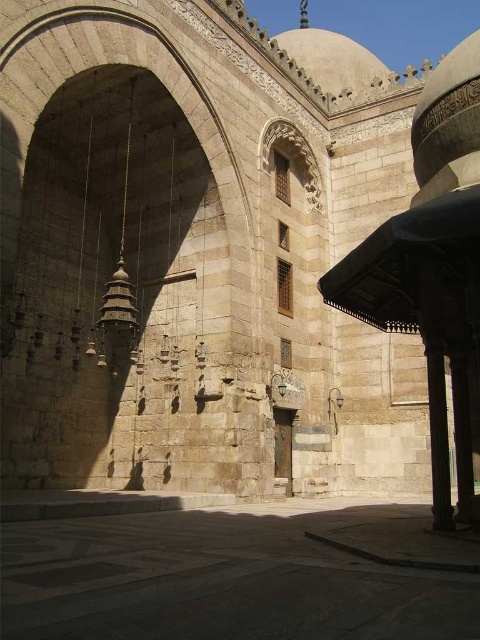
Does gray stone courtyard at lower center have a greater width compared to brown stone pillar at right?

Yes, gray stone courtyard at lower center is wider than brown stone pillar at right.

Describe the element at coordinates (240, 573) in the screenshot. I see `gray stone courtyard at lower center` at that location.

Image resolution: width=480 pixels, height=640 pixels. Find the location of `gray stone courtyard at lower center`. gray stone courtyard at lower center is located at coordinates (240, 573).